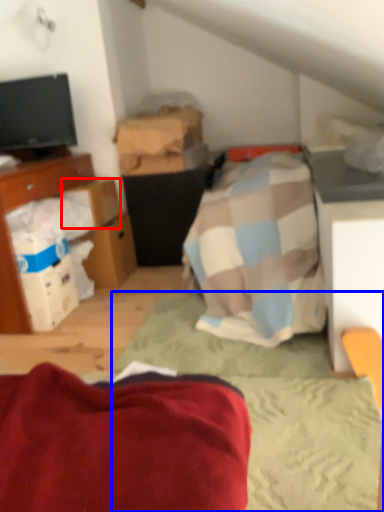
Question: Which object appears closest to the camera in this image, cardboard box (highlighted by a red box) or bed frame (highlighted by a blue box)?

Choices:
 (A) cardboard box
 (B) bed frame

Answer: (B)